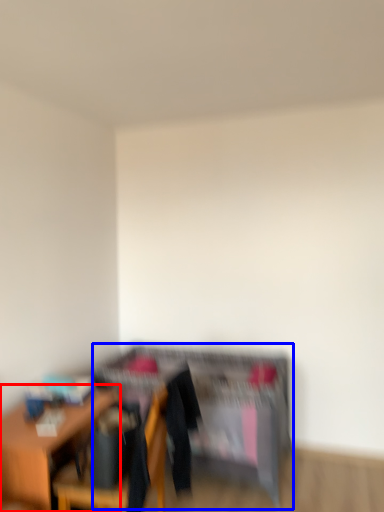
Question: Which object is closer to the camera taking this photo, table (highlighted by a red box) or dresser (highlighted by a blue box)?

Choices:
 (A) table
 (B) dresser

Answer: (A)